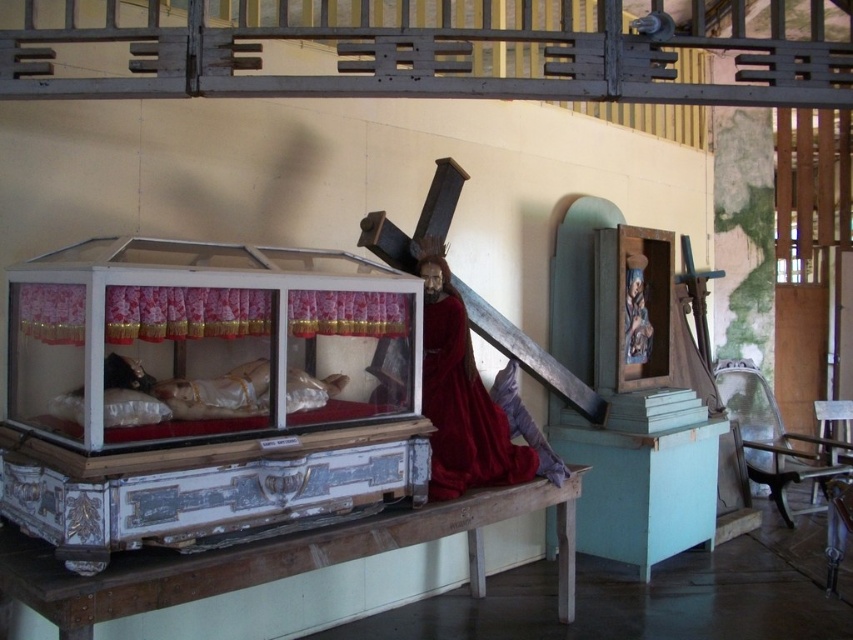
Question: Which of the following is the farthest from the observer?

Choices:
 (A) red velvet robe at center
 (B) white painted wood altar at lower center
 (C) white painted wood sarcophagus at center

Answer: (A)

Question: Which point appears closest to the camera in this image?

Choices:
 (A) (20, 378)
 (B) (9, 593)

Answer: (B)

Question: Considering the relative positions of white painted wood sarcophagus at center and red velvet robe at center in the image provided, where is white painted wood sarcophagus at center located with respect to red velvet robe at center?

Choices:
 (A) above
 (B) below

Answer: (A)

Question: Is white painted wood sarcophagus at center bigger than red velvet robe at center?

Choices:
 (A) yes
 (B) no

Answer: (A)

Question: Is white painted wood sarcophagus at center closer to camera compared to red velvet robe at center?

Choices:
 (A) yes
 (B) no

Answer: (A)

Question: Among these objects, which one is farthest from the camera?

Choices:
 (A) white painted wood sarcophagus at center
 (B) red velvet robe at center
 (C) white painted wood altar at lower center

Answer: (B)